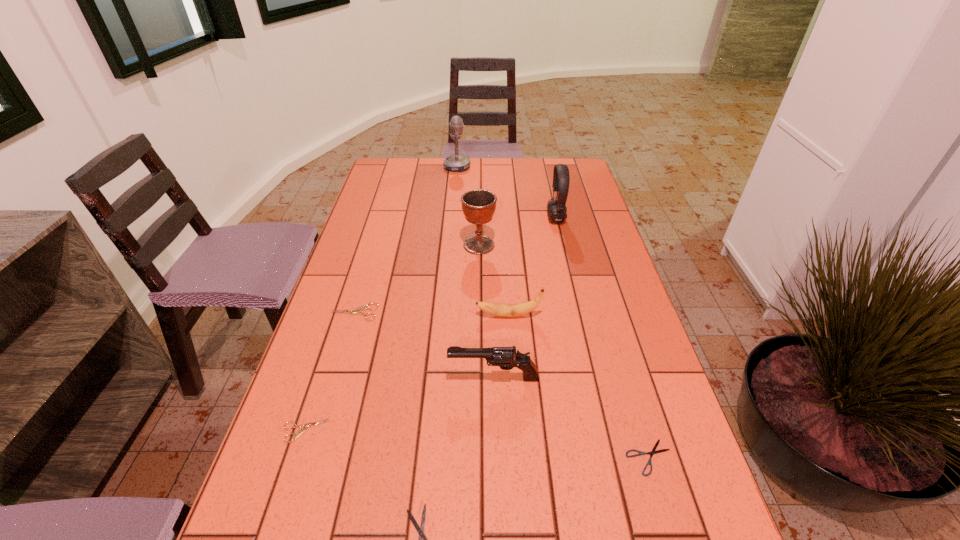
Where is `microphone`? Image resolution: width=960 pixels, height=540 pixels. microphone is located at coordinates (456, 162).

This screenshot has width=960, height=540. What are the coordinates of `the eighth nearest object` in the screenshot? It's located at (557, 209).

What are the coordinates of `the third farthest object` in the screenshot? It's located at (478, 205).

You are a GUI agent. You are given a task and a screenshot of the screen. Output one action in this format:
    pyautogui.click(x=<x>, y=<y>)
    Task: Click on the fourth nearest object
    The width and height of the screenshot is (960, 540).
    Given the screenshot: What is the action you would take?
    pyautogui.click(x=506, y=358)

This screenshot has width=960, height=540. I want to click on gun, so click(506, 358).

In order to click on yellow banana in this screenshot , I will do `click(520, 309)`.

This screenshot has height=540, width=960. I want to click on banana, so click(520, 309).

Locate an element on the screen. The height and width of the screenshot is (540, 960). the fourth shortest object is located at coordinates (356, 311).

Identify the location of the farther beige shears. The height and width of the screenshot is (540, 960). (356, 311).

Where is `the smaller beige shears`? the smaller beige shears is located at coordinates (301, 431).